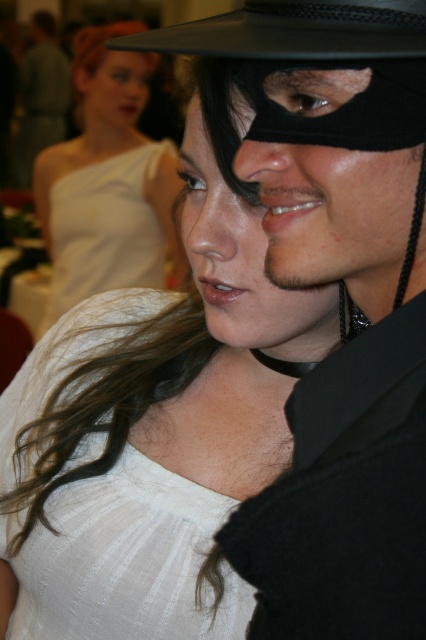
You are a photographer at a masquerade ball. You need to position a spotlight on the matte white dress at center and the black matte mask at upper right. Since the spotlight can only cover one object at a time, which object should you aim the spotlight at first if you want to capture them in order from left to right?

The matte white dress at center is to the left of the black matte mask at upper right, so you should aim the spotlight at the matte white dress at center first before moving to the black matte mask at upper right.

You are a photographer at the event and need to adjust the lighting to ensure both the black matte mask at upper right and the matte black mask at center are clearly visible. Which mask should you focus on first to ensure it isn not obscured by the other?

The black matte mask at upper right is in front of the matte black mask at center, so you should focus on the matte black mask at center first to ensure it isn not obscured by the black matte mask at upper right.

You are a photographer at a masquerade party. You need to adjust the lighting so that both the matte white dress at center and the black matte mask at upper right are clearly visible. Considering their positions, which object might require more direct light to ensure it stands out?

The black matte mask at upper right requires more direct light because it is positioned under the matte white dress at center, which might cast a shadow over it.